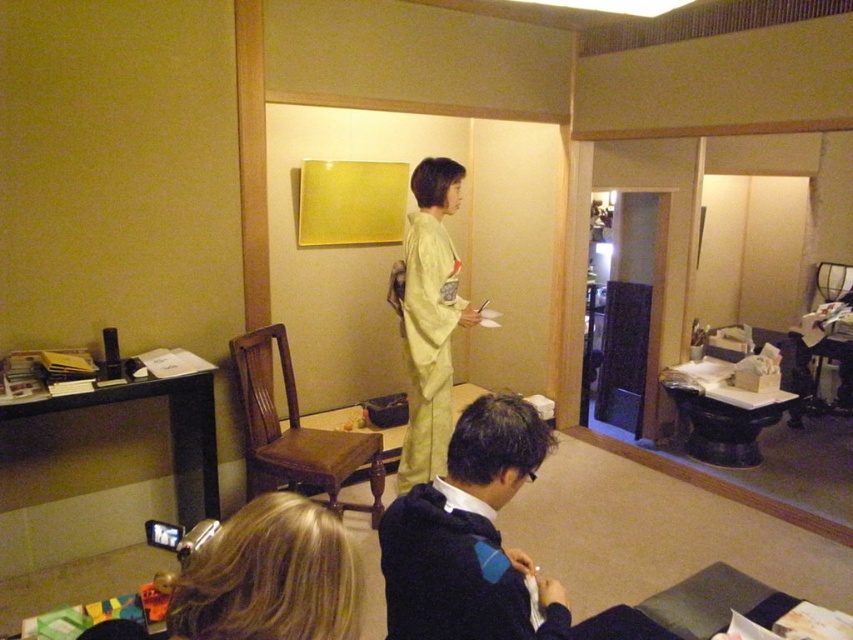
You are a photographer trying to capture a clear shot of the dark blue sweater at lower center and the blonde hair at lower center. Which object is closer to the camera?

The dark blue sweater at lower center is closer to the camera since it is further to the viewer than the blonde hair at lower center.

You are standing in the room and want to place a small decoration between the two points, point (434, 506) and point (451, 294). Which point should the decoration be closer to in order to appear larger in the image?

The decoration should be placed closer to point (434, 506) because it is closer to the viewer, making objects placed there appear larger in the image.

You are standing in the room and want to take a photo of the blonde hair at lower center. Where should you position your camera to capture it best?

The blonde hair at lower center is located at the 2D coordinates point (270, 577), so you should position your camera to aim directly at that point to capture it best.